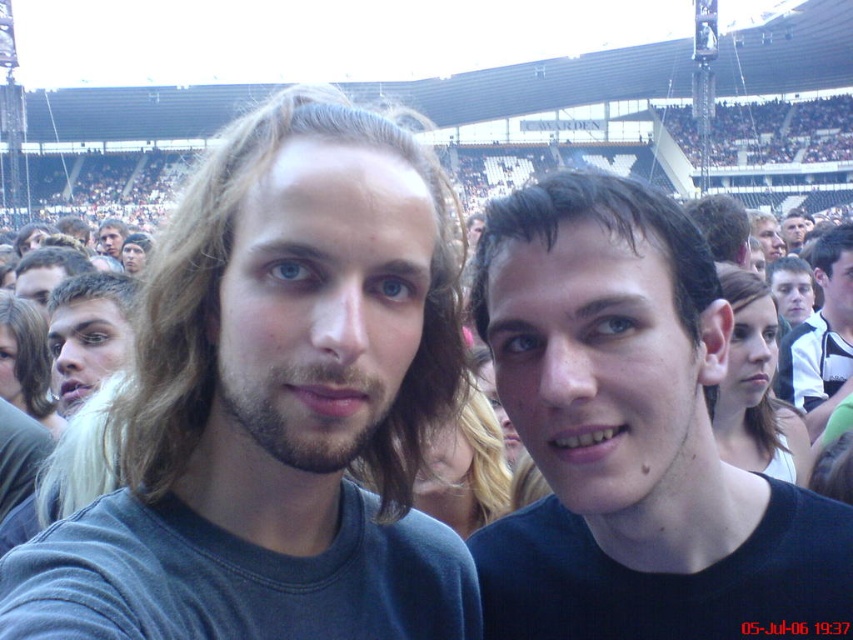
Question: From the image, what is the correct spatial relationship of black matte shirt at center in relation to blonde hair at left?

Choices:
 (A) below
 (B) above

Answer: (A)

Question: Can you confirm if black matte shirt at center is positioned to the right of smooth skin face at center?

Choices:
 (A) yes
 (B) no

Answer: (B)

Question: Estimate the real-world distances between objects in this image. Which object is farther from the dark gray t-shirt at center?

Choices:
 (A) blonde hair at left
 (B) smooth black shirt at center
 (C) black matte shirt at center

Answer: (B)

Question: Which of the following is the farthest from the observer?

Choices:
 (A) blonde hair at left
 (B) dark gray t-shirt at center

Answer: (A)

Question: Can you confirm if blonde hair at left is smaller than smooth skin face at center?

Choices:
 (A) no
 (B) yes

Answer: (B)

Question: Which object is closer to the camera taking this photo?

Choices:
 (A) smooth black shirt at center
 (B) blonde hair at left
 (C) black matte shirt at center

Answer: (C)